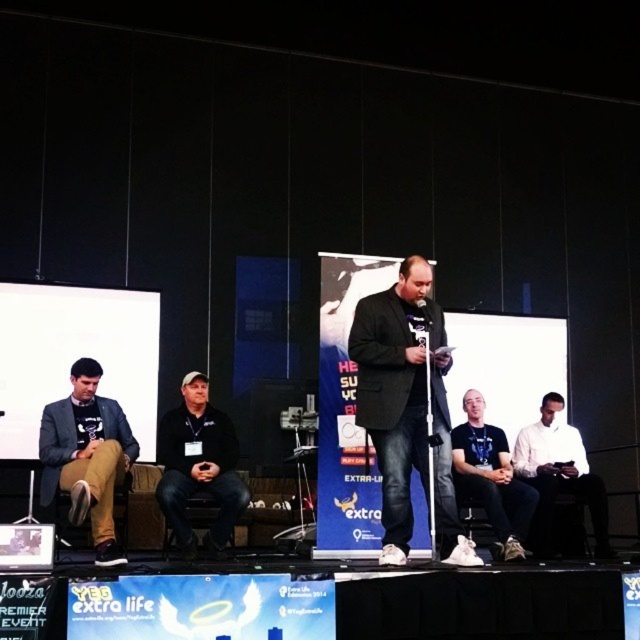
You are an event coordinator trying to adjust the lighting for a presentation. You notice the matte black jacket at left and the black fabric cap at center on stage. Which object should you focus your spotlight on to ensure it covers the larger item?

The matte black jacket at left has a larger size compared to the black fabric cap at center, so you should focus the spotlight on the matte black jacket at left to ensure it covers the larger item.

You are attending an event and want to take a photo of the stage. The camera you have can only focus on objects within 5 meters. There is a point marked at coordinates point (605, 525) on the stage. Can you focus on this point with your camera?

The point (605, 525) is 5.63 meters from the camera, which is beyond the camera focus range of 5 meters. Therefore, the camera cannot focus on this point.